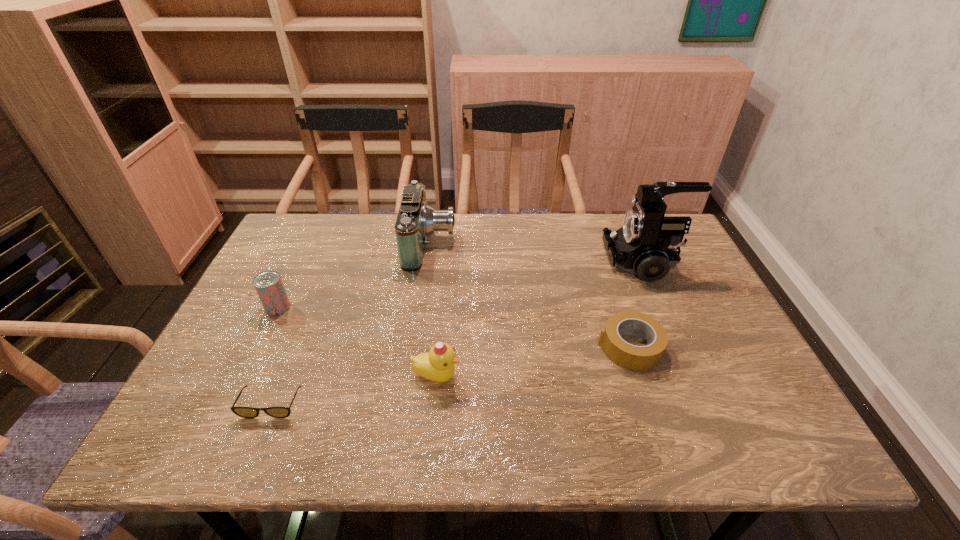
This screenshot has height=540, width=960. Identify the location of vacant area located 0.140m on the lens mount of the right camcorder. (559, 262).

Find the location of `vacant area situated 0.140m on the lens mount of the right camcorder`. vacant area situated 0.140m on the lens mount of the right camcorder is located at coordinates (559, 262).

The image size is (960, 540). In order to click on free space located on the lens mount of the right camcorder in this screenshot , I will do `click(508, 262)`.

Where is `vacant space located on the front-facing side of the shorter camcorder`? The width and height of the screenshot is (960, 540). vacant space located on the front-facing side of the shorter camcorder is located at coordinates (530, 244).

Image resolution: width=960 pixels, height=540 pixels. I want to click on free location located 0.300m on the front-facing side of the fourth shortest object, so click(594, 376).

Where is `blank area located 0.100m on the right of the beer can`? The height and width of the screenshot is (540, 960). blank area located 0.100m on the right of the beer can is located at coordinates tap(328, 307).

Where is `vacant space located 0.210m at the edge of the fifth tallest object`? The width and height of the screenshot is (960, 540). vacant space located 0.210m at the edge of the fifth tallest object is located at coordinates (511, 347).

The height and width of the screenshot is (540, 960). In order to click on vacant space located 0.160m at the edge of the fifth tallest object in this screenshot , I will do `click(531, 347)`.

Where is `free space located at the edge of the fifth tallest object`? free space located at the edge of the fifth tallest object is located at coordinates (540, 347).

Where is `object located at the near edge`? object located at the near edge is located at coordinates (245, 412).